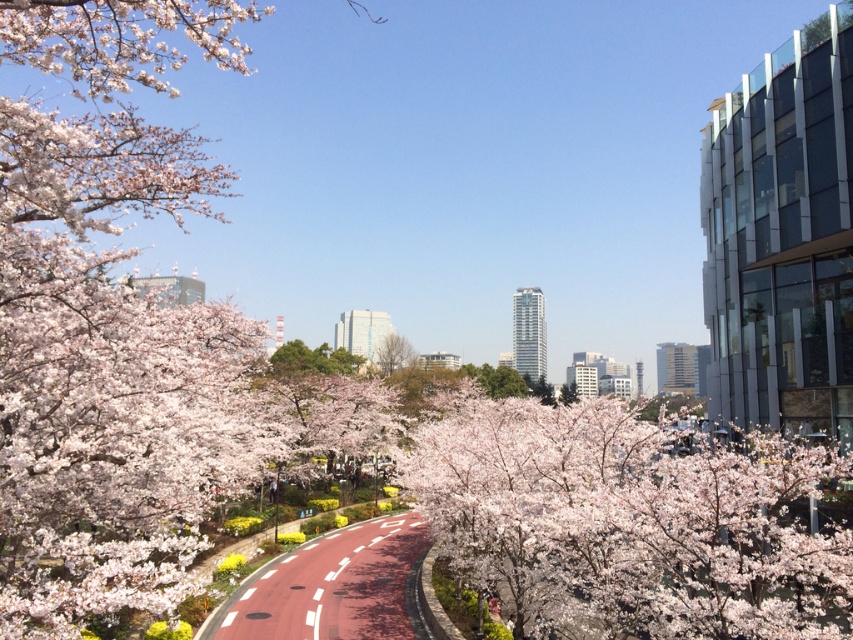
You are a city planner reviewing the urban scene. You need to determine if the pink blossoms at center are positioned in a way that they might obstruct the view of the green leafy tree at center from the pathway. Based on their positions, what do you observe?

The pink blossoms at center are located below the green leafy tree at center, so they are positioned in a way that they might obstruct the view of the green leafy tree at center from the pathway.